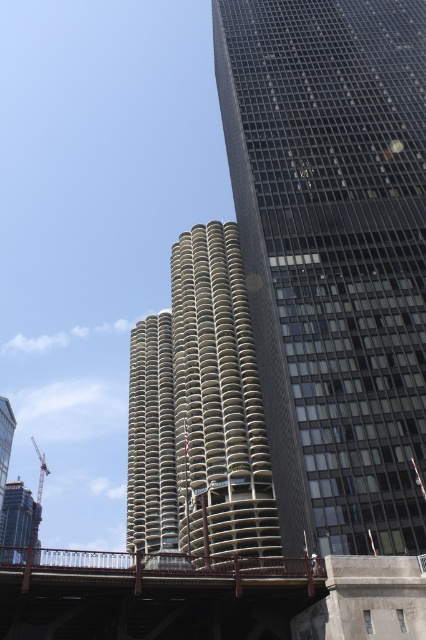
Question: Among these points, which one is farthest from the camera?

Choices:
 (A) (347, 301)
 (B) (2, 451)
 (C) (32, 541)
 (D) (166, 532)

Answer: (C)

Question: Which object is positioned closest to the metallic gray crane at lower left?

Choices:
 (A) dark glass skyscraper at center
 (B) metallic safety harness at lower center

Answer: (A)

Question: Considering the relative positions of metallic gray crane at lower left and metallic safety harness at lower center in the image provided, where is metallic gray crane at lower left located with respect to metallic safety harness at lower center?

Choices:
 (A) left
 (B) right

Answer: (A)

Question: Can you confirm if dark gray concrete building at lower left is positioned above metallic safety harness at lower center?

Choices:
 (A) no
 (B) yes

Answer: (A)

Question: Which of the following is the farthest from the observer?

Choices:
 (A) metallic gray crane at lower left
 (B) metallic silver tower at lower left

Answer: (B)

Question: Observing the image, what is the correct spatial positioning of beige concrete tower at center in reference to metallic silver tower at lower left?

Choices:
 (A) left
 (B) right

Answer: (B)